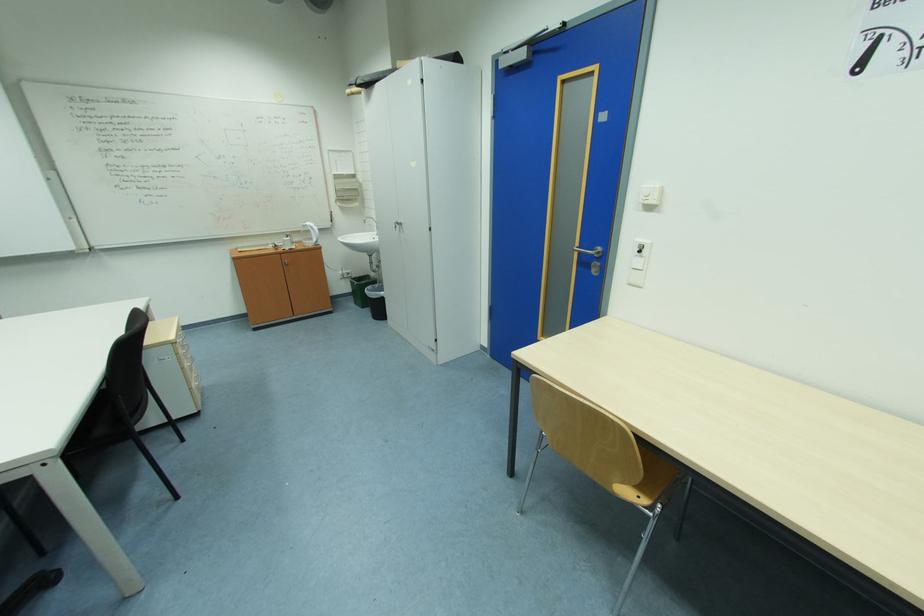
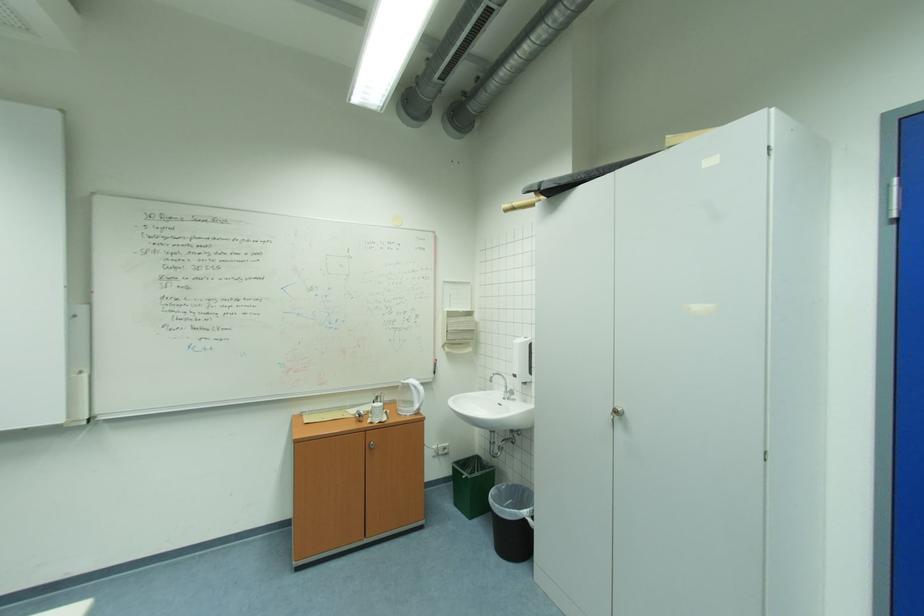
Where in the second image is the point corresponding to (383,233) from the first image?

(506, 394)